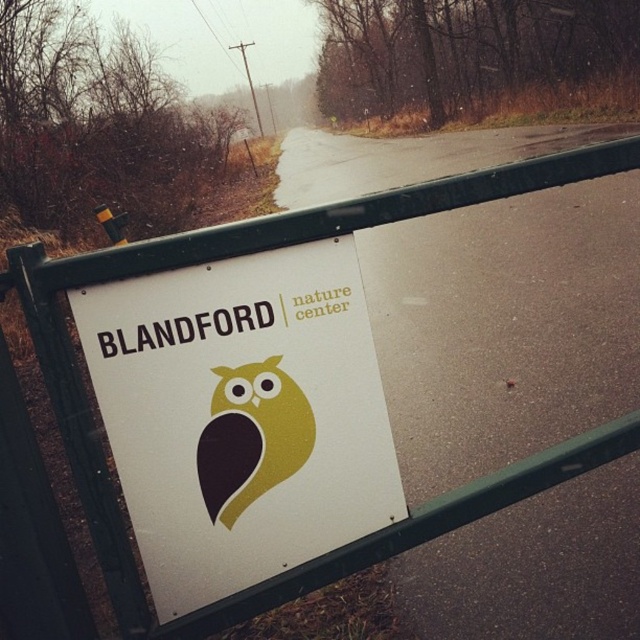
Image resolution: width=640 pixels, height=640 pixels. Describe the element at coordinates (241, 416) in the screenshot. I see `white paper sign at center` at that location.

Is white paper sign at center wider than yellow matte/soft owl at center?

Yes, white paper sign at center is wider than yellow matte/soft owl at center.

Which is in front, point (230, 522) or point (276, 481)?

Point (230, 522) is in front.

Locate an element on the screen. Image resolution: width=640 pixels, height=640 pixels. white paper sign at center is located at coordinates (241, 416).